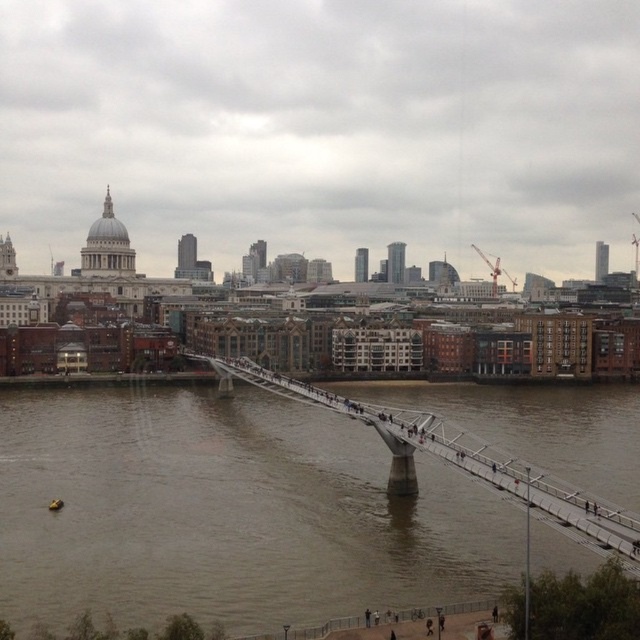
Based on the scene described, can you determine the position of the brown muddy water at center relative to the metallic gray bridge at center?

The brown muddy water at center is to the left of the metallic gray bridge at center.

From the picture: You are standing at the starting point of the Millennium Bridge in London and see two points marked in the scene. The first point is at coordinate point (35, 580) and the second is at point (326, 392). Which point is closer to your current position?

Point (35, 580) is in front of point (326, 392), so it is closer to your current position.